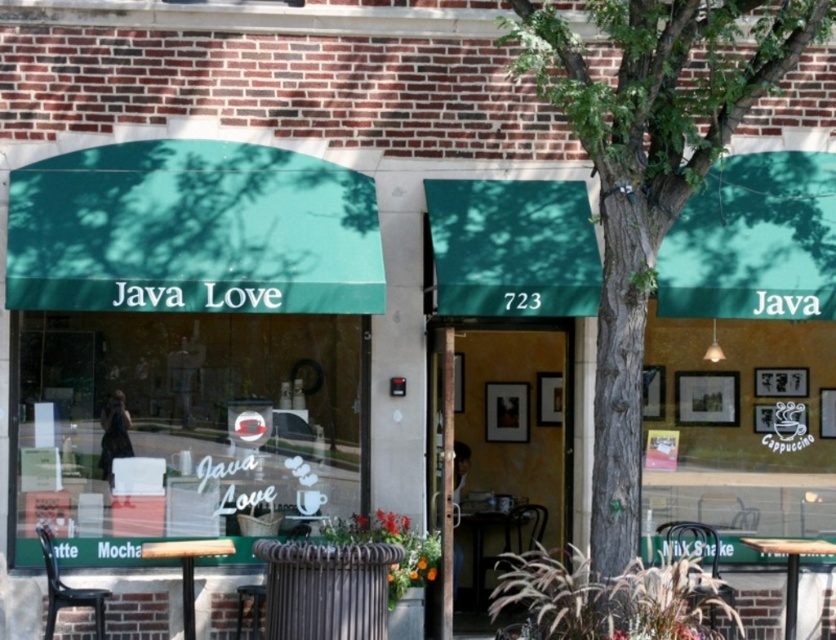
Question: Can you confirm if wooden table at lower left is smaller than wooden table at lower right?

Choices:
 (A) yes
 (B) no

Answer: (A)

Question: Which of these objects is positioned closest to the green textured tree at center?

Choices:
 (A) wooden table at lower right
 (B) wooden table at lower left

Answer: (A)

Question: Does green textured tree at center appear on the left side of wooden table at lower right?

Choices:
 (A) yes
 (B) no

Answer: (A)

Question: Considering the real-world distances, which object is farthest from the wooden table at lower left?

Choices:
 (A) green textured tree at center
 (B) wooden table at lower right

Answer: (B)

Question: Does green textured tree at center have a greater width compared to wooden table at lower left?

Choices:
 (A) yes
 (B) no

Answer: (A)

Question: Which of the following is the closest to the observer?

Choices:
 (A) wooden table at lower right
 (B) green textured tree at center

Answer: (B)